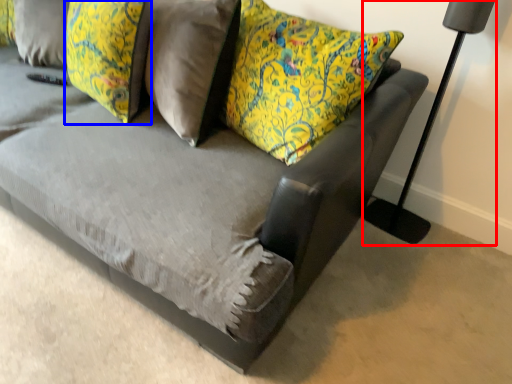
Question: Which object is further to the camera taking this photo, table lamp (highlighted by a red box) or pillow (highlighted by a blue box)?

Choices:
 (A) table lamp
 (B) pillow

Answer: (B)